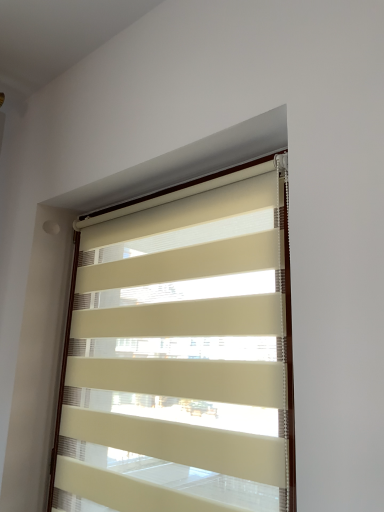
I want to click on beige fabric blinds at center, so click(x=180, y=352).

The height and width of the screenshot is (512, 384). What do you see at coordinates (180, 352) in the screenshot?
I see `beige fabric blinds at center` at bounding box center [180, 352].

Locate an element on the screen. Image resolution: width=384 pixels, height=512 pixels. beige fabric blinds at center is located at coordinates pyautogui.click(x=180, y=352).